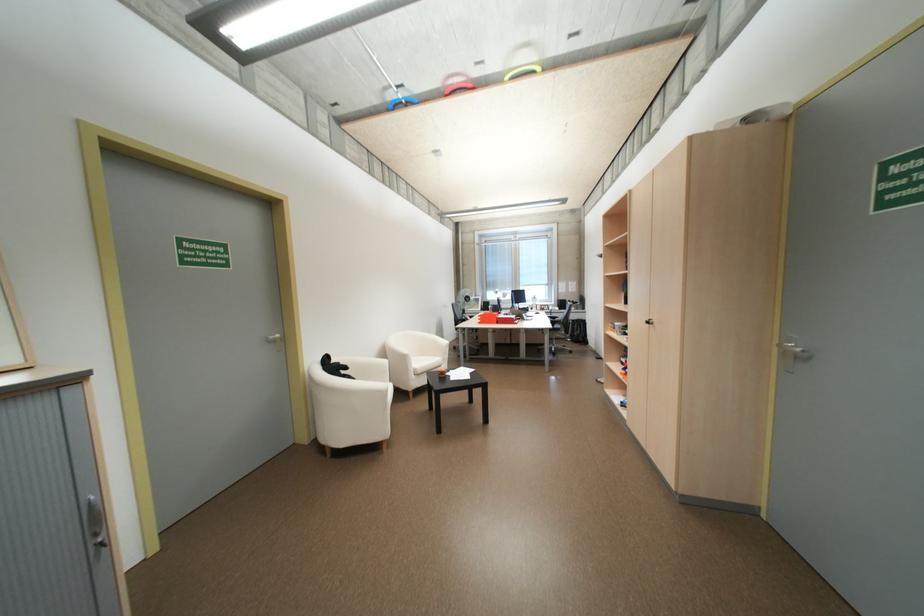
The image size is (924, 616). What are the coordinates of `white chair sitting surface` in the screenshot? It's located at (426, 362).